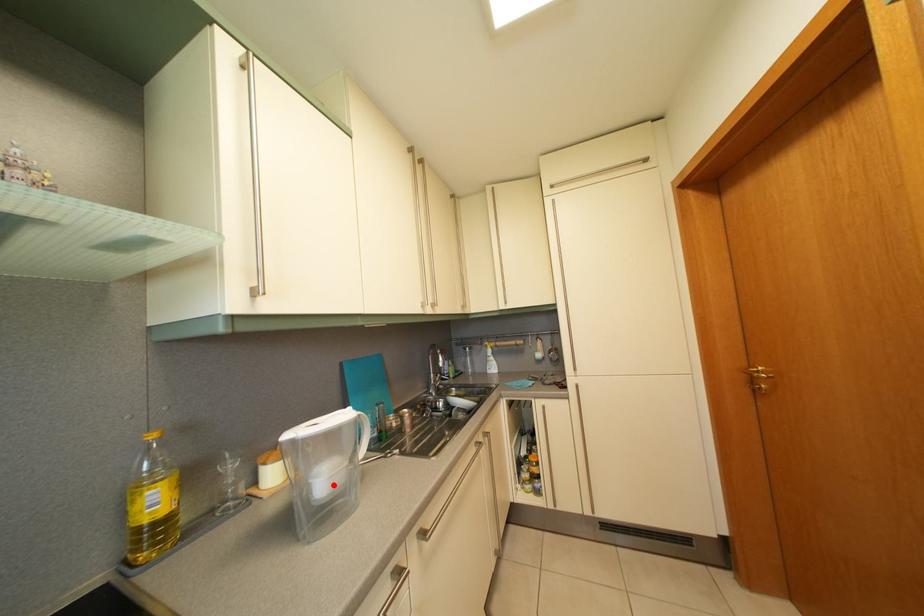
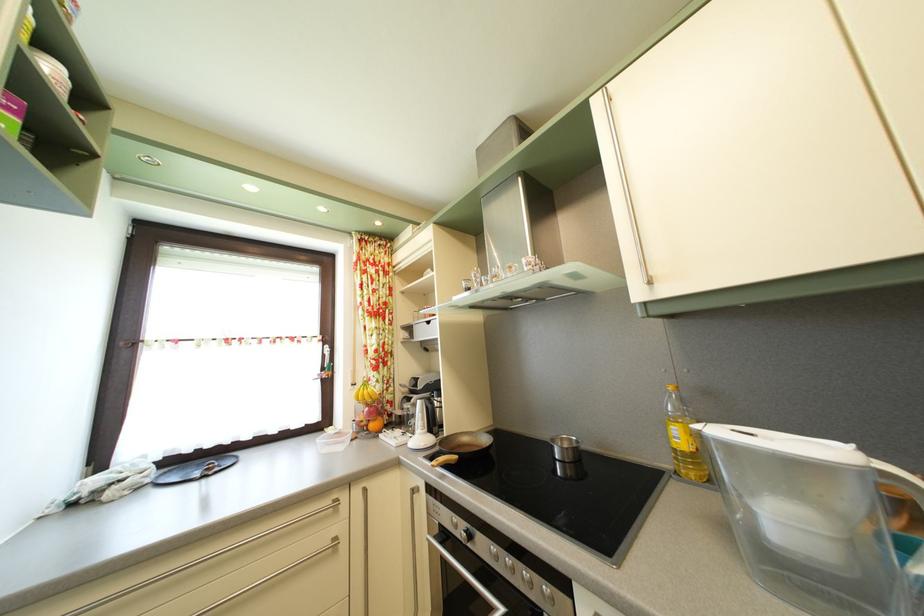
The point at the highlighted location is marked in the first image. Where is the corresponding point in the second image?

(793, 528)